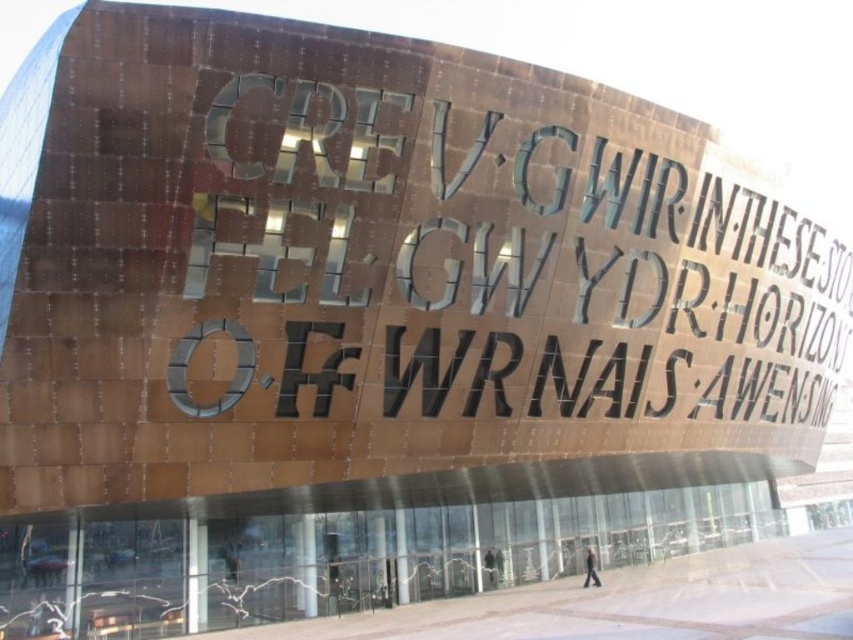
You are standing at the entrance of the building and see two points marked on the facade. The first point is at coordinate point (486, 570) and the second is at point (495, 556). From your perspective at the entrance, which point is closer to you?

Point (486, 570) is in front of point (495, 556), so it is closer to you.

You are standing in front of the building and see both the dark gray jacket at center and the dark gray suit at center. Which one is nearer to you?

The dark gray jacket at center is closer to the viewer than the dark gray suit at center.